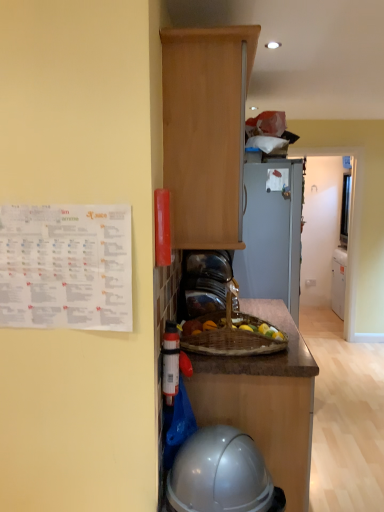
Question: Is wooden cabinet at upper center shorter than glossy plastic helmet at lower center?

Choices:
 (A) yes
 (B) no

Answer: (B)

Question: Can you confirm if wooden cabinet at upper center is thinner than glossy plastic helmet at lower center?

Choices:
 (A) no
 (B) yes

Answer: (B)

Question: Considering the relative sizes of wooden cabinet at upper center and glossy plastic helmet at lower center in the image provided, is wooden cabinet at upper center taller than glossy plastic helmet at lower center?

Choices:
 (A) yes
 (B) no

Answer: (A)

Question: Is wooden cabinet at upper center further to the viewer compared to glossy plastic helmet at lower center?

Choices:
 (A) no
 (B) yes

Answer: (B)

Question: Is wooden cabinet at upper center to the left of glossy plastic helmet at lower center from the viewer's perspective?

Choices:
 (A) no
 (B) yes

Answer: (B)

Question: In the image, is wooden cabinet at upper center on the left side or the right side of glossy plastic helmet at lower center?

Choices:
 (A) right
 (B) left

Answer: (B)

Question: From a real-world perspective, relative to glossy plastic helmet at lower center, is wooden cabinet at upper center vertically above or below?

Choices:
 (A) below
 (B) above

Answer: (B)

Question: Is wooden cabinet at upper center bigger or smaller than glossy plastic helmet at lower center?

Choices:
 (A) big
 (B) small

Answer: (A)

Question: Considering their positions, is wooden cabinet at upper center located in front of or behind glossy plastic helmet at lower center?

Choices:
 (A) front
 (B) behind

Answer: (B)

Question: In the image, is glossy plastic helmet at lower center positioned in front of or behind wooden cabinet at upper center?

Choices:
 (A) behind
 (B) front

Answer: (B)

Question: From the image's perspective, is glossy plastic helmet at lower center positioned above or below wooden cabinet at upper center?

Choices:
 (A) above
 (B) below

Answer: (B)

Question: Is glossy plastic helmet at lower center inside or outside of wooden cabinet at upper center?

Choices:
 (A) inside
 (B) outside

Answer: (B)

Question: Is point tap(216, 451) positioned closer to the camera than point tap(210, 112)?

Choices:
 (A) farther
 (B) closer

Answer: (B)

Question: Is point (304, 347) closer or farther from the camera than point (187, 57)?

Choices:
 (A) closer
 (B) farther

Answer: (B)

Question: Do you think brown polished wood at center is within wooden cabinet at upper center, or outside of it?

Choices:
 (A) outside
 (B) inside

Answer: (A)